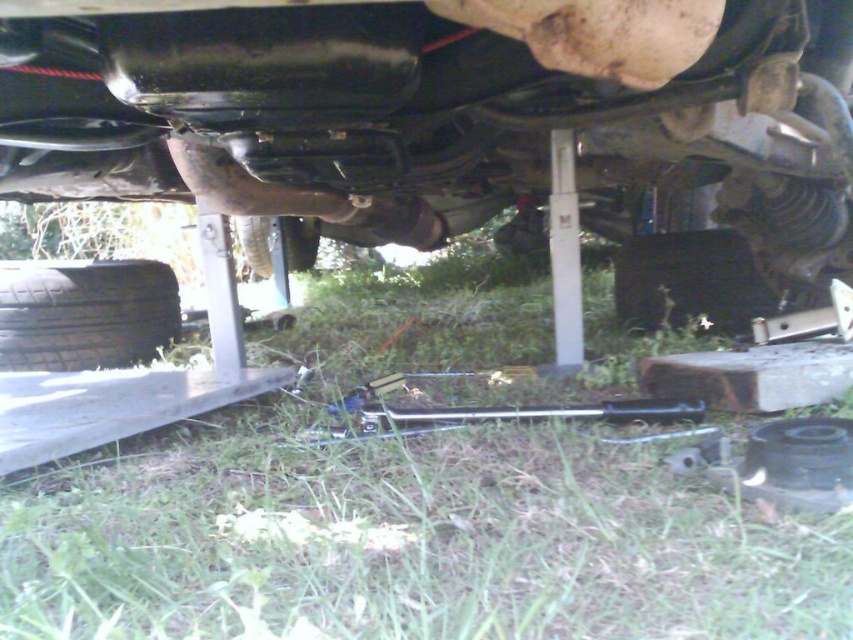
You are a mechanic working on a car. You need to place a tool on the ground between the green grass at lower center and the matte black car at center. What is the minimum distance you need to move the tool to ensure it is placed exactly halfway between them?

The green grass at lower center is 21.92 inches from the matte black car at center. To place the tool exactly halfway, you need to move it 10.96 inches from either the green grass at lower center or the matte black car at center.

You are a mechanic working on a car. You need to reach a specific point under the car to inspect a part. The point is located at coordinates point [54,301]. If your arm can extend 2 meters, can you reach that point without moving?

The point [54,301] is 2.37 meters from the viewer, which is beyond the reach of your 2 meter arm. You will need to move closer to reach it.